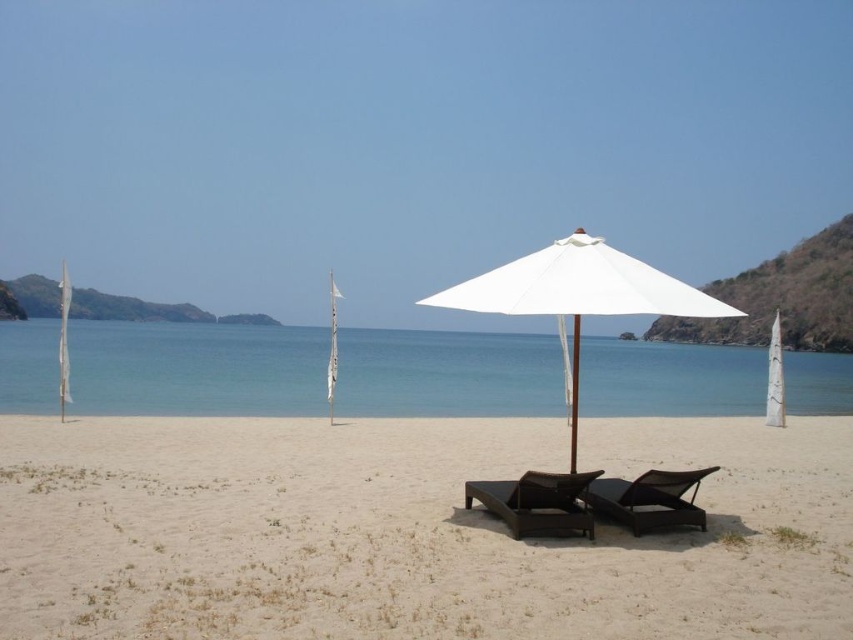
Does white fabric umbrella at center have a greater height compared to white fabric pole at center?

Yes.

Which is in front, point (508, 280) or point (570, 442)?

Point (508, 280)

Image resolution: width=853 pixels, height=640 pixels. I want to click on white fabric umbrella at center, so click(579, 285).

Does blue water at center appear under white fabric pole at center?

Actually, blue water at center is above white fabric pole at center.

Is point (204, 381) positioned after point (577, 323)?

Yes, point (204, 381) is farther from viewer.

Identify the location of blue water at center. Image resolution: width=853 pixels, height=640 pixels. (196, 369).

Which is below, blue water at center or white fabric umbrella at center?

blue water at center is lower down.

Who is more forward, (53,394) or (569,241)?

Point (569,241)

Does point (129, 380) come in front of point (706, 308)?

No.

Locate an element on the screen. blue water at center is located at coordinates (196, 369).